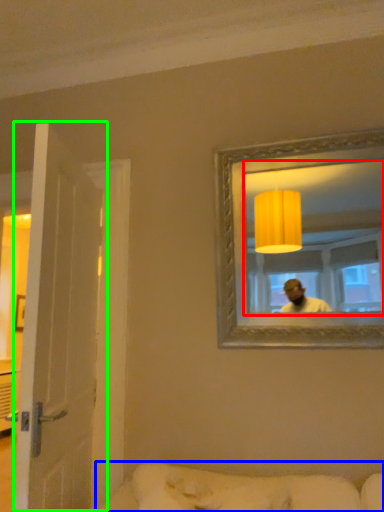
Question: Which object is the farthest from mirror (highlighted by a red box)? Choose among these: studio couch (highlighted by a blue box) or door (highlighted by a green box).

Choices:
 (A) studio couch
 (B) door

Answer: (B)